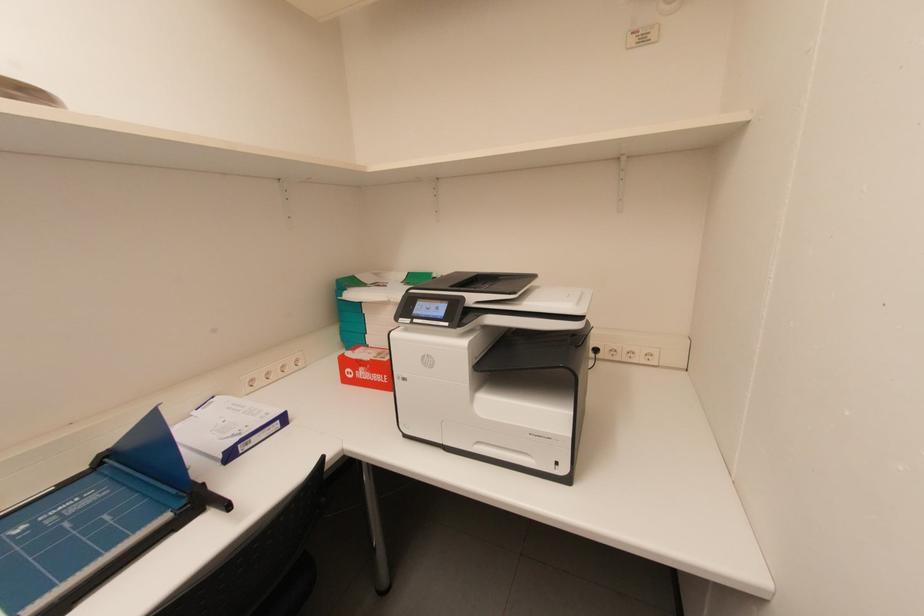
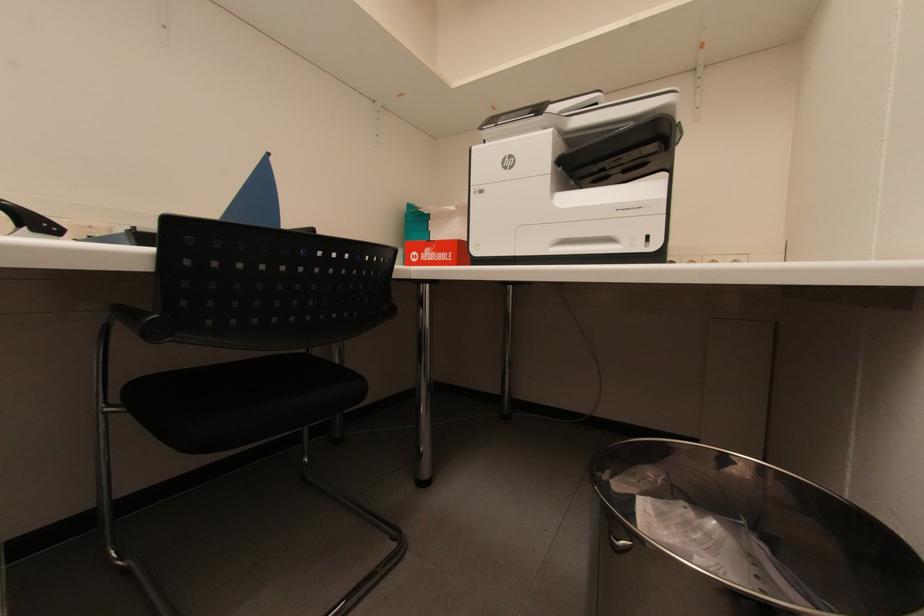
Question: How did the camera likely rotate?

Choices:
 (A) Left
 (B) Right
 (C) Up
 (D) Down

Answer: (C)